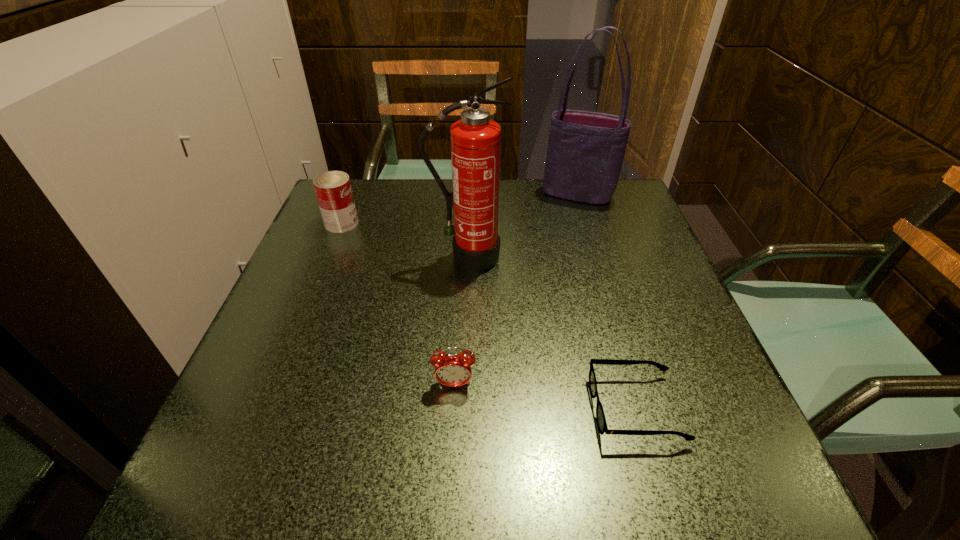
Find the location of `object present at the far right corner`. object present at the far right corner is located at coordinates (585, 153).

Where is `object present at the near right corner`? The image size is (960, 540). object present at the near right corner is located at coordinates (600, 416).

Find the location of a particular element. The height and width of the screenshot is (540, 960). vacant space at the far edge of the desktop is located at coordinates (398, 206).

Image resolution: width=960 pixels, height=540 pixels. I want to click on free location at the near edge, so click(x=473, y=461).

In the image, there is a desktop. Where is `vacant region at the left edge`? vacant region at the left edge is located at coordinates (325, 301).

Locate an element on the screen. The image size is (960, 540). vacant space at the right edge of the desktop is located at coordinates (639, 408).

Identify the location of free space at the far left corner. The image size is (960, 540). click(x=365, y=199).

Find the location of `free space at the near right corner of the desktop`. free space at the near right corner of the desktop is located at coordinates (653, 458).

I want to click on unoccupied position between the tote bag and the fourth tallest object, so click(516, 289).

The width and height of the screenshot is (960, 540). I want to click on vacant space in between the third nearest object and the fourth tallest object, so click(x=461, y=320).